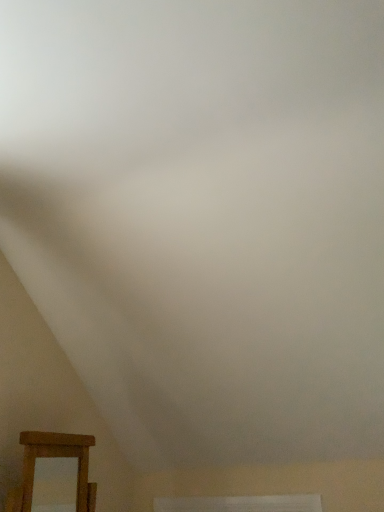
The width and height of the screenshot is (384, 512). Identify the location of brown wooden stool at lower left. (54, 459).

The width and height of the screenshot is (384, 512). Describe the element at coordinates (54, 459) in the screenshot. I see `brown wooden stool at lower left` at that location.

Locate an element on the screen. Image resolution: width=384 pixels, height=512 pixels. brown wooden stool at lower left is located at coordinates (54, 459).